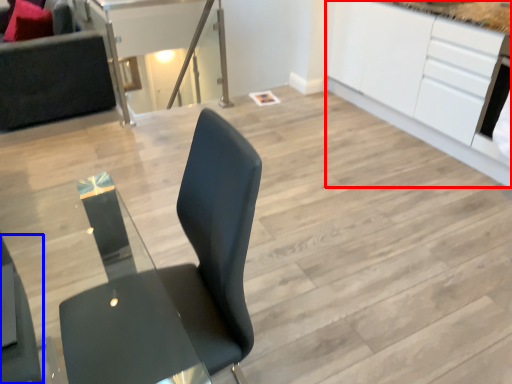
Question: Among these objects, which one is nearest to the camera, cabinetry (highlighted by a red box) or chair (highlighted by a blue box)?

Choices:
 (A) cabinetry
 (B) chair

Answer: (B)